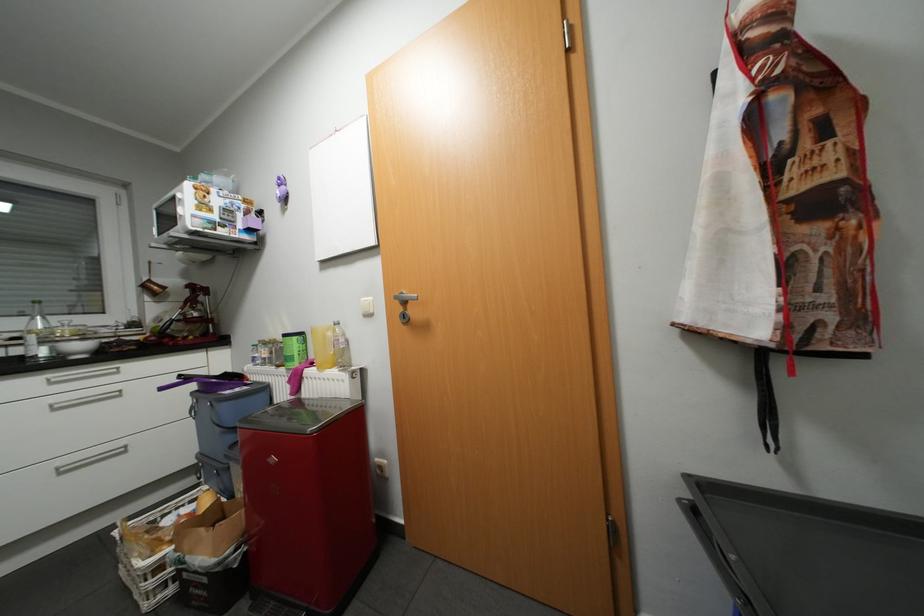
Find where to lift the purple lid handle. Please return your answer as a coordinate pair (x, y).

(164, 385)